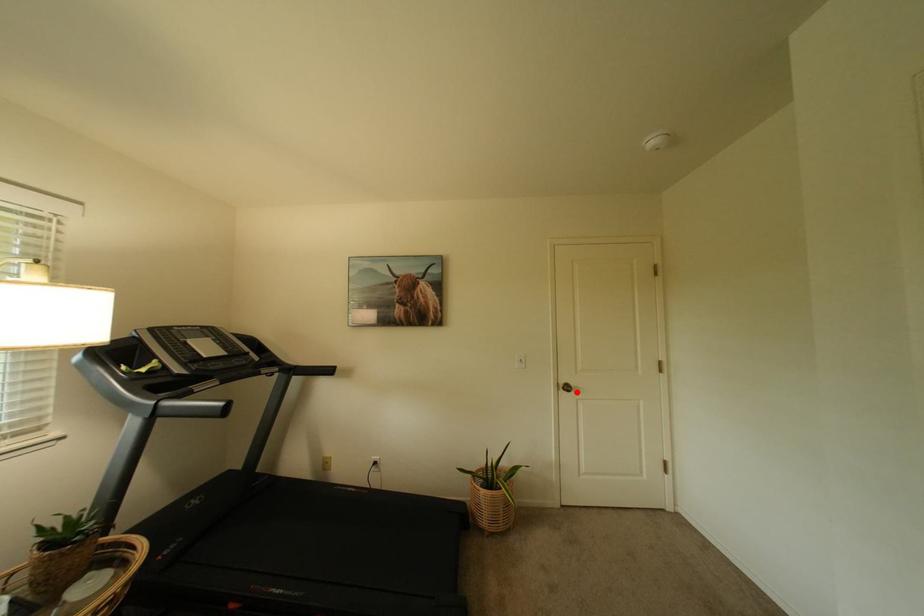
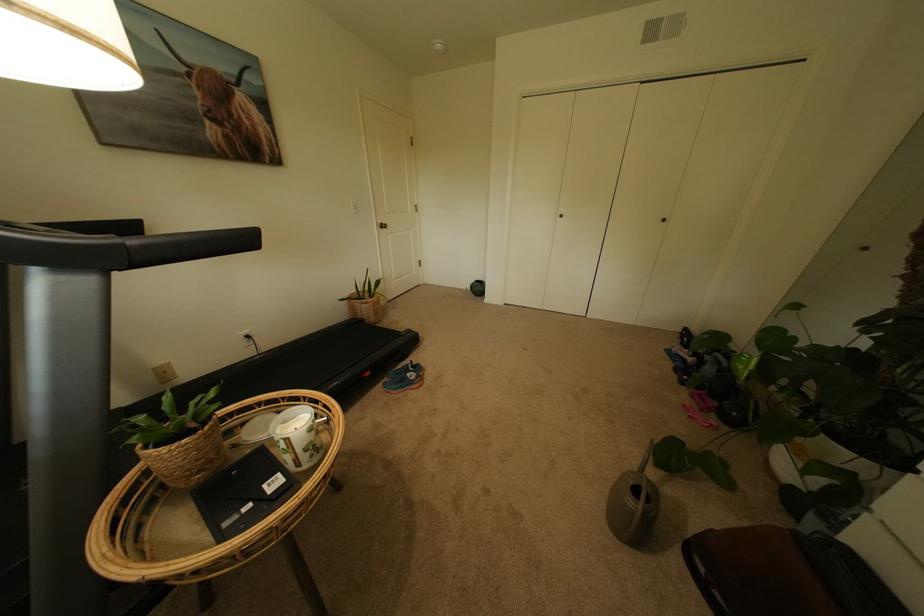
The point at the highlighted location is marked in the first image. Where is the corresponding point in the second image?

(394, 229)